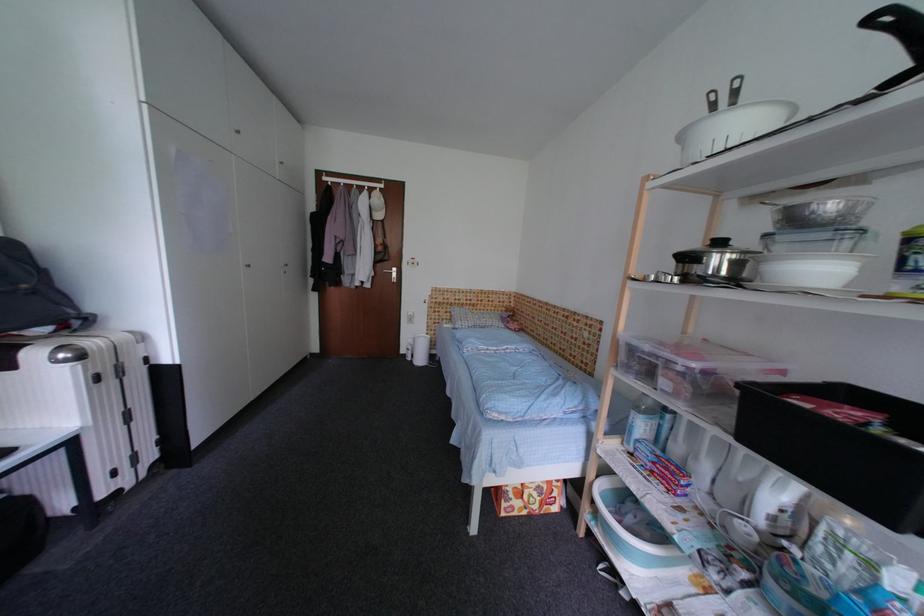
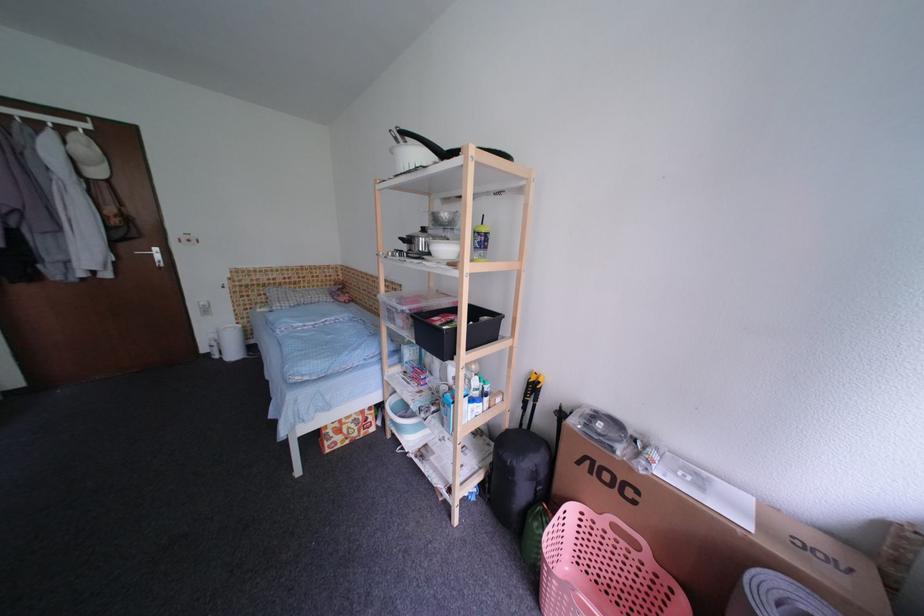
In the second image, find the point that corresponds to pixel 723 259 in the first image.

(430, 241)